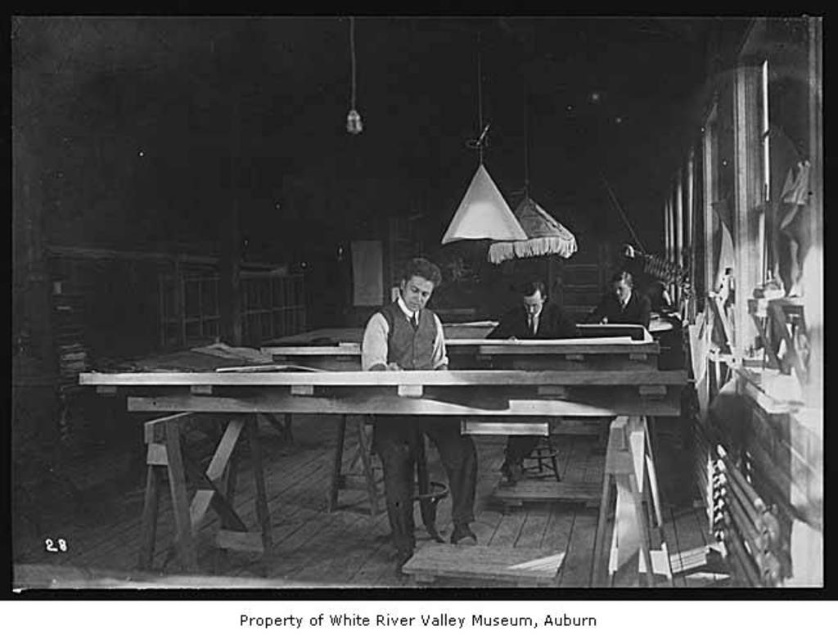
Question: Is wooden table at center bigger than smooth wood table at center?

Choices:
 (A) yes
 (B) no

Answer: (A)

Question: Which of these objects is positioned farthest from the wooden table at center?

Choices:
 (A) smooth wooden desk at center
 (B) smooth wood table at center

Answer: (A)

Question: Is wooden table at center smaller than smooth wooden desk at center?

Choices:
 (A) yes
 (B) no

Answer: (B)

Question: Does wooden table at center have a lesser width compared to smooth wooden desk at center?

Choices:
 (A) yes
 (B) no

Answer: (B)

Question: Among these points, which one is nearest to the camera?

Choices:
 (A) (582, 342)
 (B) (529, 438)

Answer: (B)

Question: Based on their relative distances, which object is farther from the smooth wooden desk at center?

Choices:
 (A) smooth wood table at center
 (B) wooden table at center

Answer: (B)